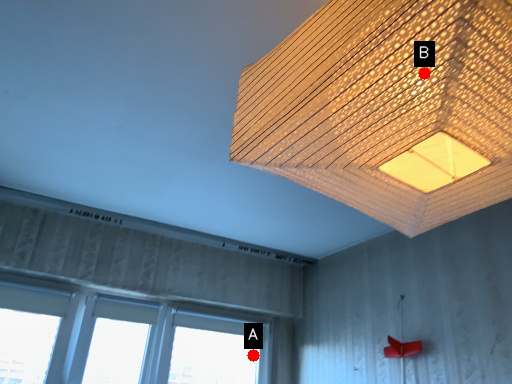
Question: Two points are circled on the image, labeled by A and B beside each circle. Which of the following is the closest to the observer?

Choices:
 (A) A is closer
 (B) B is closer

Answer: (B)